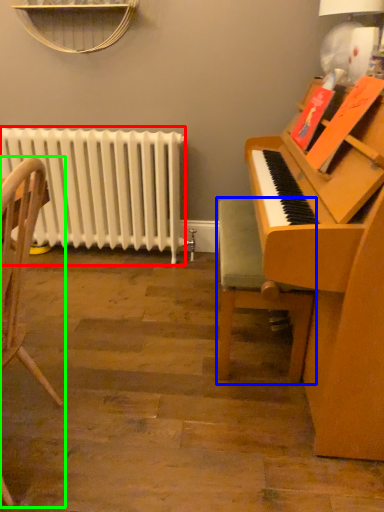
Question: Estimate the real-world distances between objects in this image. Which object is closer to radiator (highlighted by a red box), chair (highlighted by a blue box) or chair (highlighted by a green box)?

Choices:
 (A) chair
 (B) chair

Answer: (A)